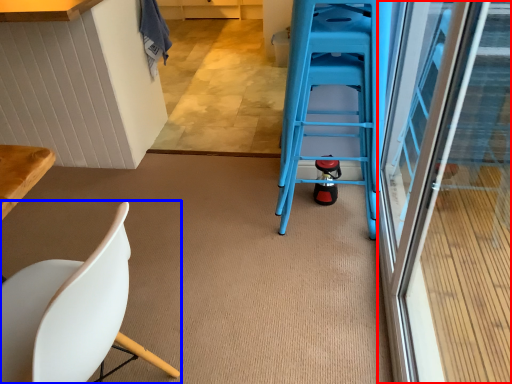
Question: Which of the following is the closest to the observer, screen door (highlighted by a red box) or chair (highlighted by a blue box)?

Choices:
 (A) screen door
 (B) chair

Answer: (A)